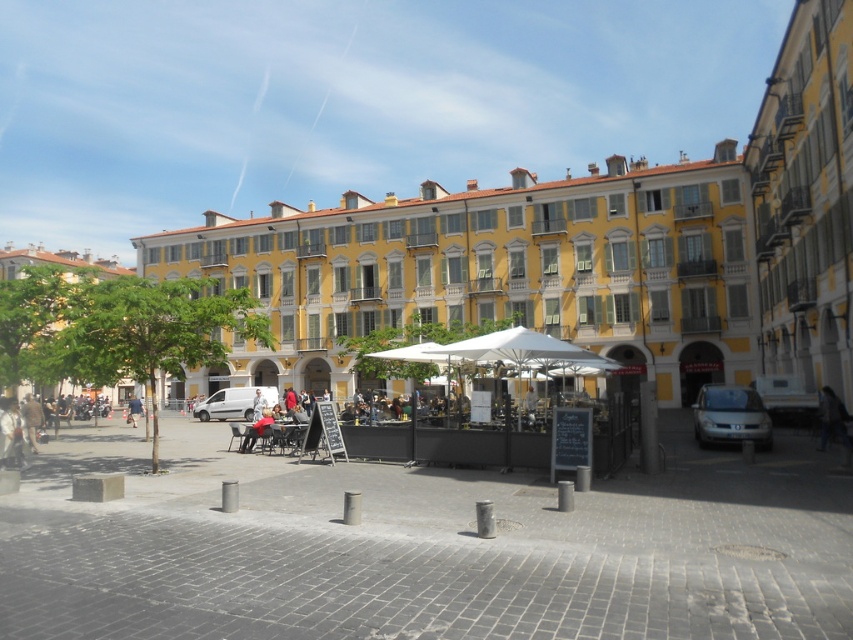
How far apart are denim jacket at center and denim jacket at lower left?

A distance of 18.31 meters exists between denim jacket at center and denim jacket at lower left.

Can you confirm if denim jacket at center is bigger than denim jacket at lower left?

No.

Between point (256, 420) and point (126, 419), which one is positioned behind?

The point (126, 419) is behind.

You are a GUI agent. You are given a task and a screenshot of the screen. Output one action in this format:
    pyautogui.click(x=<x>, y=<y>)
    Task: Click on the denim jacket at center
    
    Given the screenshot: What is the action you would take?
    click(x=256, y=429)